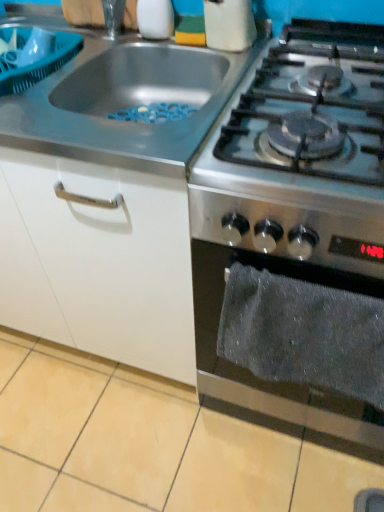
Question: Considering their positions, is white glossy salt shaker at upper center located in front of or behind stainless steel gas stove at upper right, which appears as the 2th gas stove when viewed from the right?

Choices:
 (A) behind
 (B) front

Answer: (A)

Question: From a real-world perspective, relative to stainless steel gas stove at upper right, the 1th gas stove positioned from the left, is white glossy salt shaker at upper center vertically above or below?

Choices:
 (A) above
 (B) below

Answer: (A)

Question: Which object is the closest to the gray fabric towel at lower right?

Choices:
 (A) stainless steel gas stove at upper right, the 1th gas stove positioned from the left
 (B) white glossy salt shaker at upper center
 (C) stainless steel gas stove at right, positioned as the first gas stove in right-to-left order

Answer: (C)

Question: Based on their relative distances, which object is nearer to the gray fabric towel at lower right?

Choices:
 (A) stainless steel gas stove at right, positioned as the first gas stove in right-to-left order
 (B) white glossy salt shaker at upper center
 (C) stainless steel gas stove at upper right, the 1th gas stove positioned from the left

Answer: (A)